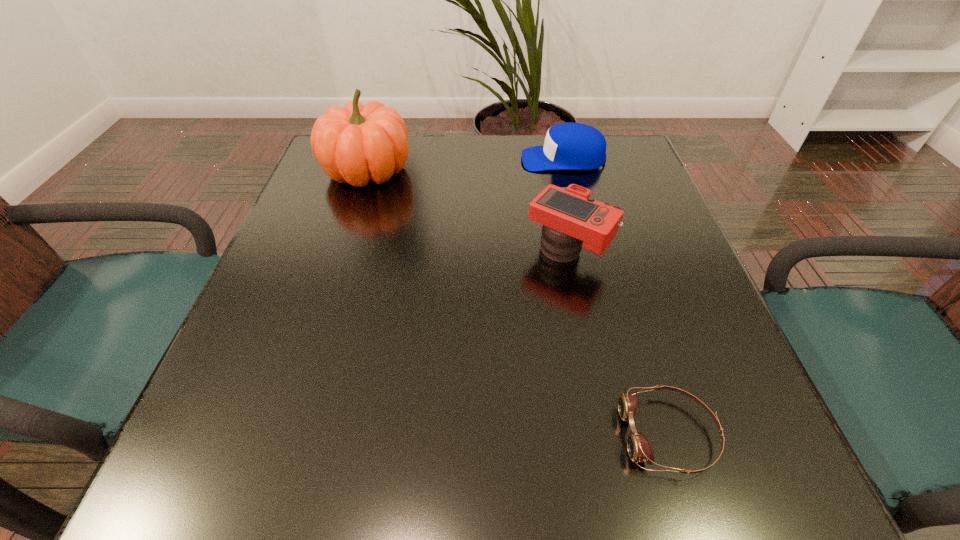
Identify which object is the second closest to the nearest object. Please provide its 2D coordinates. Your answer should be formatted as a tuple, i.e. [(x, y)], where the tuple contains the x and y coordinates of a point satisfying the conditions above.

[(568, 146)]

Find the location of `vacant space that satisfies the following two spatial constraints: 1. on the front-facing side of the third tallest object; 2. on the front side of the second tallest object`. vacant space that satisfies the following two spatial constraints: 1. on the front-facing side of the third tallest object; 2. on the front side of the second tallest object is located at coordinates (587, 253).